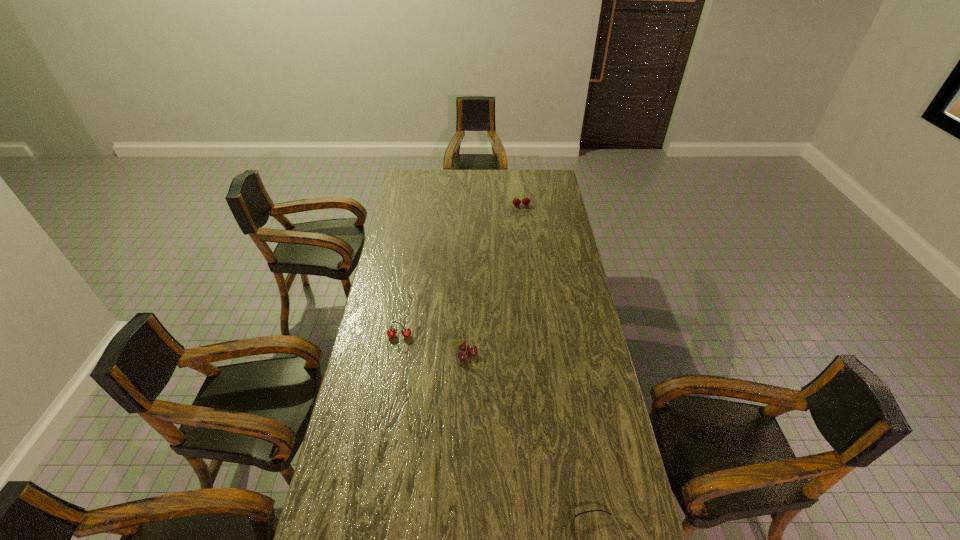
The image size is (960, 540). In order to click on the farthest object in this screenshot , I will do `click(525, 201)`.

Find the location of a particular element. The image size is (960, 540). the tallest cherry is located at coordinates (525, 201).

Where is `the leftmost cherry`? The image size is (960, 540). the leftmost cherry is located at coordinates (391, 332).

Identify the location of the third nearest object. (391, 332).

The image size is (960, 540). Identify the location of the third object from right to left. (463, 346).

In order to click on the third farthest object in this screenshot , I will do `click(463, 346)`.

Image resolution: width=960 pixels, height=540 pixels. Identify the location of vacant space located on the surface of the farthest object. (524, 233).

The image size is (960, 540). Identify the location of vacant space positioned with stems pointing upwards on the leftmost object. (386, 417).

The image size is (960, 540). I want to click on vacant area situated on the leaves of the nearest cherry, so click(465, 379).

I want to click on object that is positioned at the left edge, so click(391, 332).